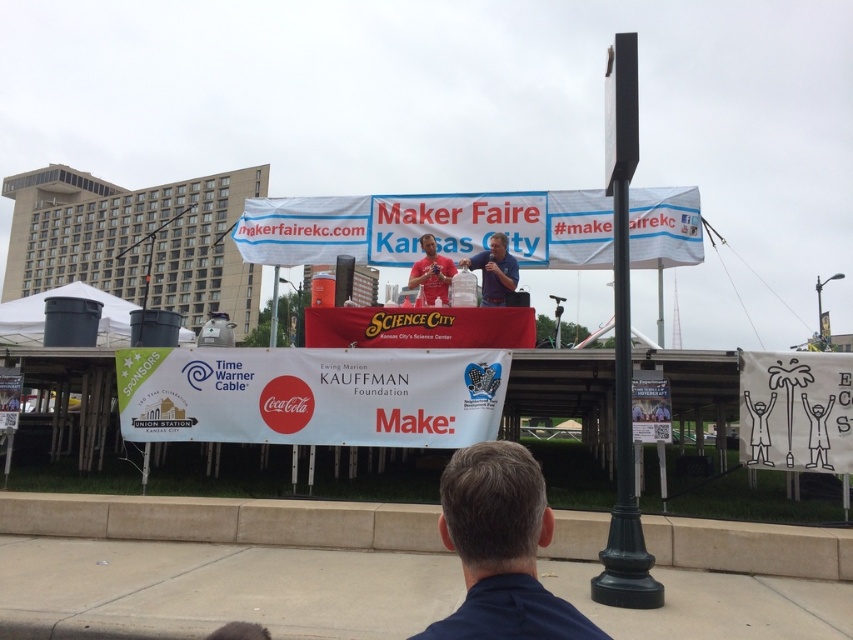
Question: Among these objects, which one is farthest from the camera?

Choices:
 (A) matte red shirt at center
 (B) dark blue shirt at center
 (C) metallic pole at upper right
 (D) white paper banner at center

Answer: (C)

Question: Is the position of green painted metal pole at center less distant than that of matte red shirt at center?

Choices:
 (A) yes
 (B) no

Answer: (A)

Question: Can you confirm if white paper banner at center is positioned below dark blue shirt at center?

Choices:
 (A) no
 (B) yes

Answer: (B)

Question: Which point is closer to the camera?

Choices:
 (A) (410, 252)
 (B) (296, 308)

Answer: (A)

Question: Does black plastic can at lower left have a smaller size compared to metallic pole at upper right?

Choices:
 (A) yes
 (B) no

Answer: (A)

Question: Which point appears farthest from the camera in this image?

Choices:
 (A) (291, 304)
 (B) (26, 326)
 (C) (497, 323)
 (D) (485, 614)

Answer: (A)